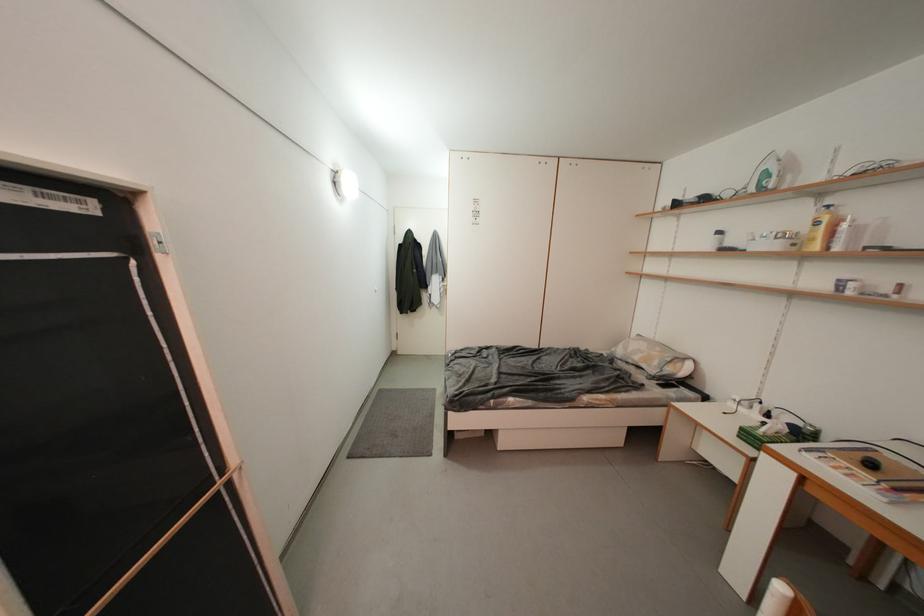
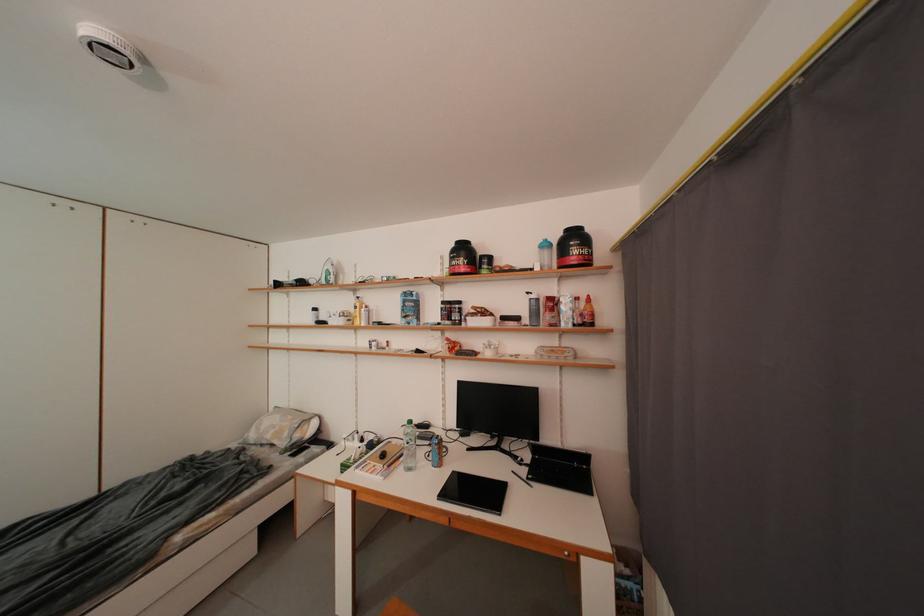
Find the pixel in the second image that matches point (663, 367) in the first image.

(294, 438)